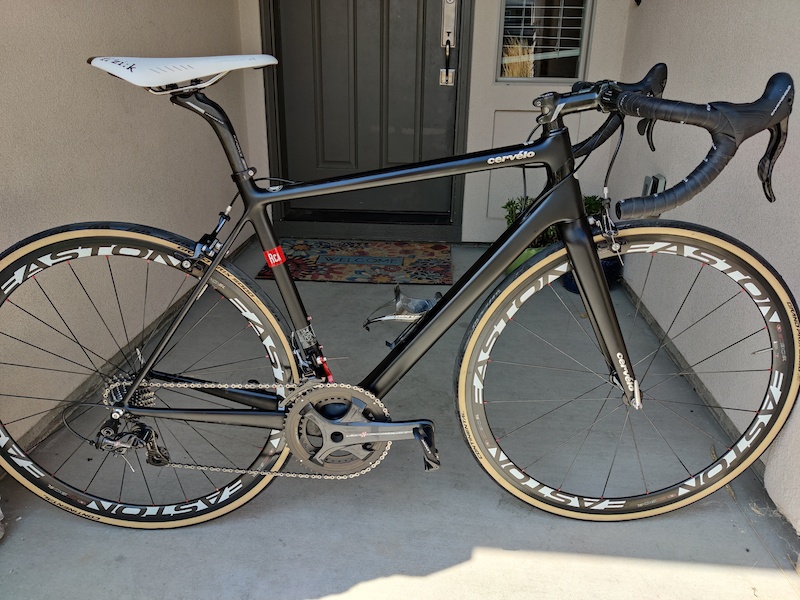
Locate an element on the screen. The width and height of the screenshot is (800, 600). handle is located at coordinates (729, 118).